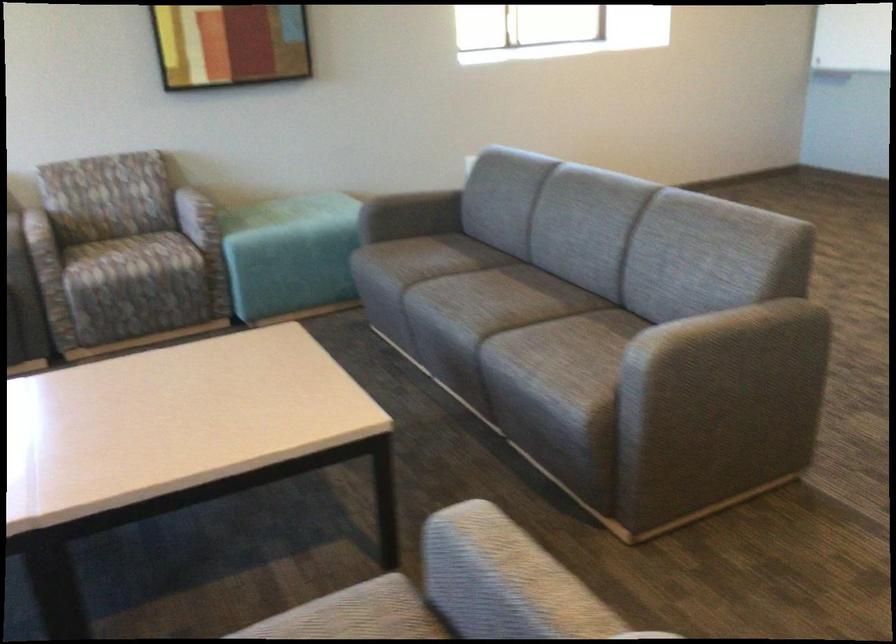
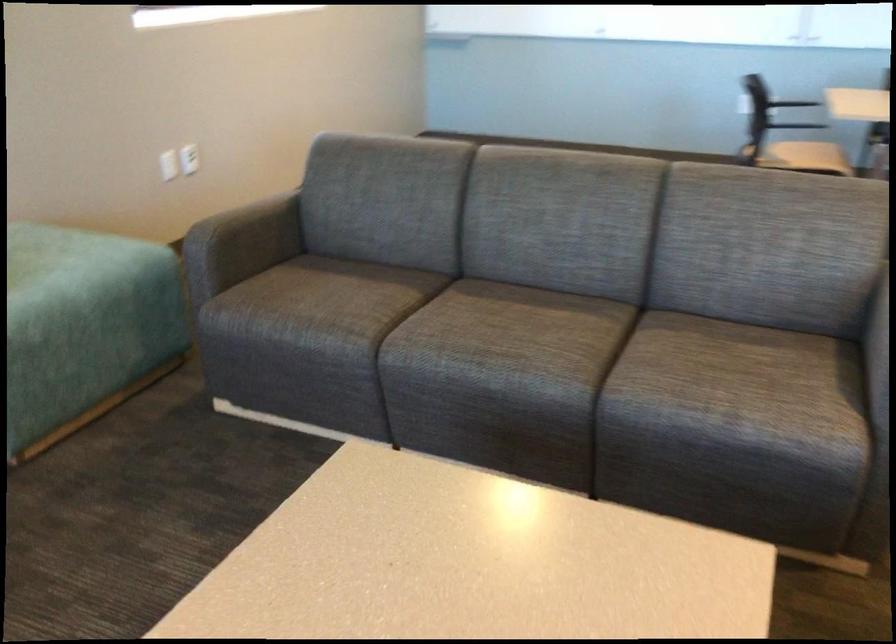
The point at (407, 289) is marked in the first image. Where is the corresponding point in the second image?

(358, 343)